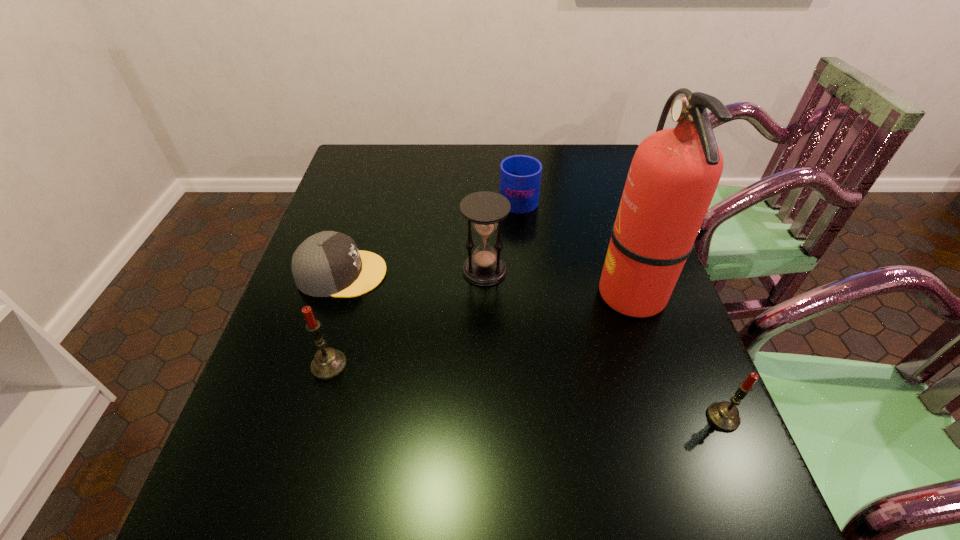
Identify the location of vacant space at the far right corner of the desktop. (590, 165).

Where is `free space between the fifth farthest object and the third shortest object`? This screenshot has width=960, height=540. free space between the fifth farthest object and the third shortest object is located at coordinates (526, 392).

Find the location of a particular element. vacant region between the fire extinguisher and the farthest object is located at coordinates (575, 245).

What are the coordinates of `free space between the hourglass and the fire extinguisher` in the screenshot? It's located at (558, 281).

The image size is (960, 540). Find the location of `vacant point located between the fifth tallest object and the second nearest object`. vacant point located between the fifth tallest object and the second nearest object is located at coordinates (423, 281).

Where is `free point between the cap and the farthest object`? The width and height of the screenshot is (960, 540). free point between the cap and the farthest object is located at coordinates (430, 235).

At what (x,y) coordinates should I click in order to perform the action: click on vacant space that's between the shortest object and the second shortest object. Please return your answer as a coordinate pair (x, y). This screenshot has width=960, height=540. Looking at the image, I should click on (430, 235).

Where is `free space that is in between the cap and the hourglass`? The width and height of the screenshot is (960, 540). free space that is in between the cap and the hourglass is located at coordinates (414, 272).

Where is `free space between the tallest object and the right candle`? free space between the tallest object and the right candle is located at coordinates (677, 355).

The image size is (960, 540). In order to click on object that is the fourth closest to the left candle in this screenshot , I will do `click(520, 176)`.